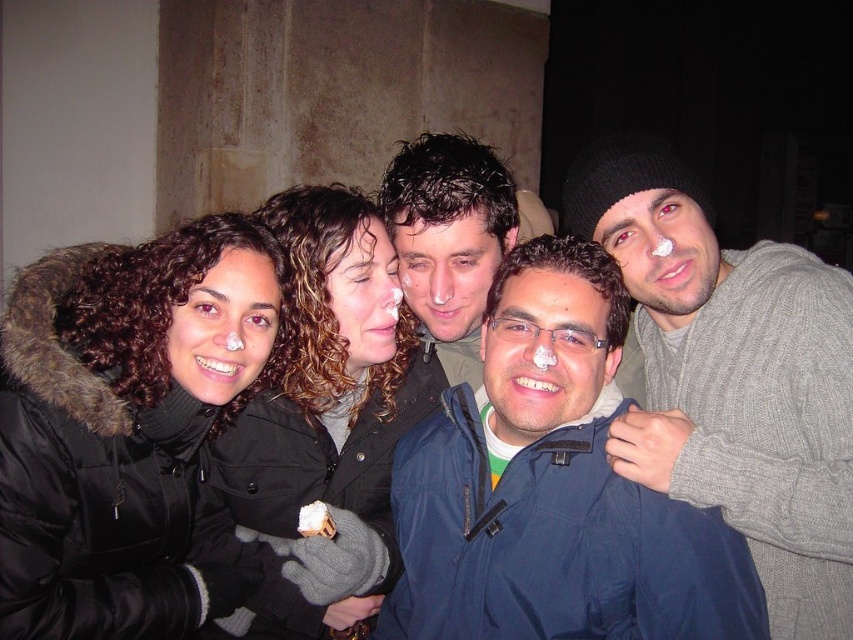
Is blue fabric jacket at center behind matte black jacket at center?

That is False.

Does blue fabric jacket at center have a greater width compared to matte black jacket at center?

Yes.

Is point (500, 557) closer to camera compared to point (463, 224)?

Yes, it is.

The height and width of the screenshot is (640, 853). What are the coordinates of `blue fabric jacket at center` in the screenshot? It's located at (552, 486).

Between black fur-lined coat at left and matte black jacket at center, which one is positioned lower?

black fur-lined coat at left is lower down.

Locate an element on the screen. black fur-lined coat at left is located at coordinates (126, 426).

Which of these two, blue fabric jacket at center or black matte jacket at center, stands shorter?

With less height is blue fabric jacket at center.

Consider the image. Can you confirm if blue fabric jacket at center is positioned below black matte jacket at center?

Yes, blue fabric jacket at center is below black matte jacket at center.

The image size is (853, 640). I want to click on blue fabric jacket at center, so click(552, 486).